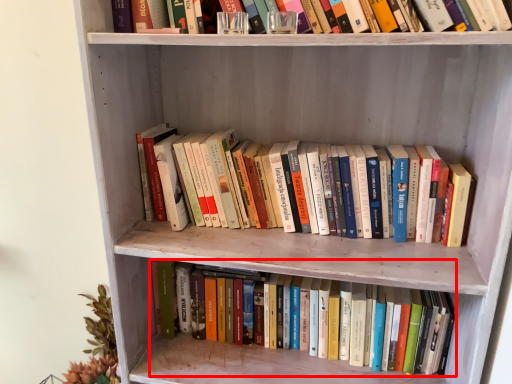
Question: Considering the relative positions of book (annotated by the red box) and book in the image provided, where is book (annotated by the red box) located with respect to the staircase?

Choices:
 (A) left
 (B) right

Answer: (B)